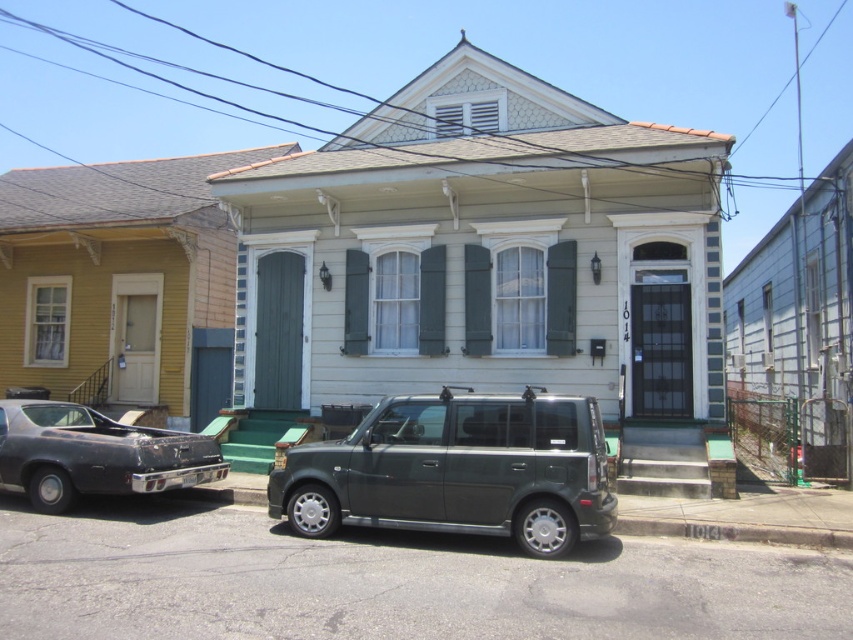
Who is taller, black wire at upper center or rusty metal car at lower left?

black wire at upper center

Which of these two, black wire at upper center or rusty metal car at lower left, stands shorter?

Standing shorter between the two is rusty metal car at lower left.

Between point (115, 104) and point (161, 433), which one is positioned in front?

Point (161, 433)

Where is `black wire at upper center`? Image resolution: width=853 pixels, height=640 pixels. black wire at upper center is located at coordinates (531, 45).

Which is more to the left, metallic gray suv at center or rusty metal car at lower left?

rusty metal car at lower left

Find the location of a particular element. The image size is (853, 640). metallic gray suv at center is located at coordinates (457, 470).

Between point (585, 488) and point (165, 445), which one is positioned behind?

Point (165, 445)

Identify the location of metallic gray suv at center. (457, 470).

Is point (350, 8) closer to viewer compared to point (491, 412)?

No, (350, 8) is behind (491, 412).

Who is lower down, black wire at upper center or metallic gray suv at center?

metallic gray suv at center

Is point (235, 134) closer to camera compared to point (395, 520)?

That is False.

Find the location of a particular element. This screenshot has width=853, height=640. black wire at upper center is located at coordinates (531, 45).